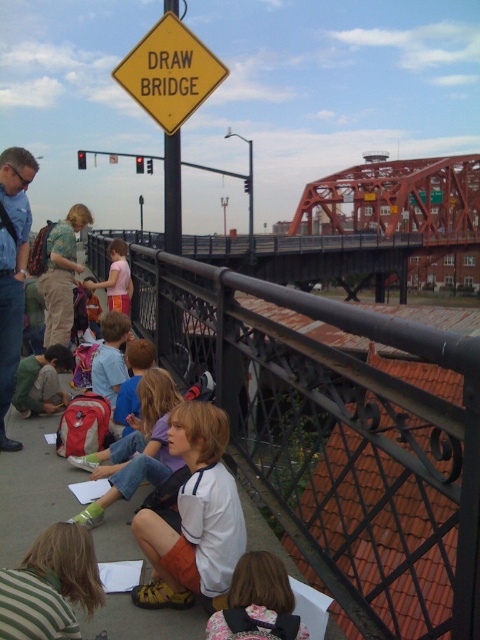
Question: Which of the following is the farthest from the observer?

Choices:
 (A) (231, 580)
 (B) (309, 237)
 (C) (124, 273)
 (D) (217, 65)

Answer: (B)

Question: Does striped fabric shirt at lower left have a smaller size compared to yellow plastic signpost at center?

Choices:
 (A) no
 (B) yes

Answer: (B)

Question: Which object is the closest to the yellow diamond-shaped sign at upper center?

Choices:
 (A) striped fabric shirt at lower left
 (B) blue denim shirt at left
 (C) pink fabric shirt at center

Answer: (B)

Question: Among these points, which one is nearest to the camera?

Choices:
 (A) (296, 616)
 (B) (85, 548)
 (C) (179, 102)
 (D) (116, 252)

Answer: (A)

Question: Is white matte shirt at center bigger than yellow plastic signpost at center?

Choices:
 (A) no
 (B) yes

Answer: (A)

Question: Does orange steel bridge at center have a larger size compared to yellow diamond-shaped sign at upper center?

Choices:
 (A) yes
 (B) no

Answer: (A)